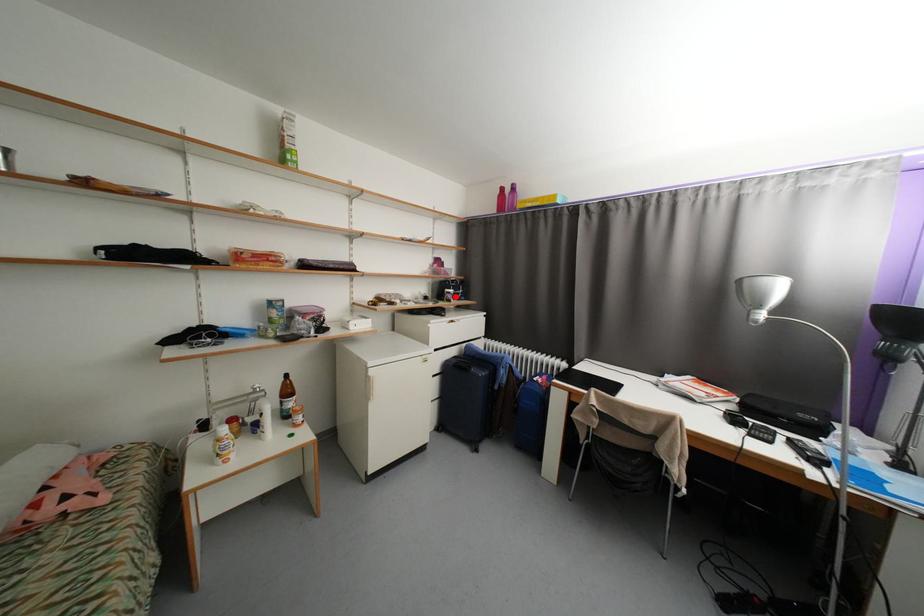
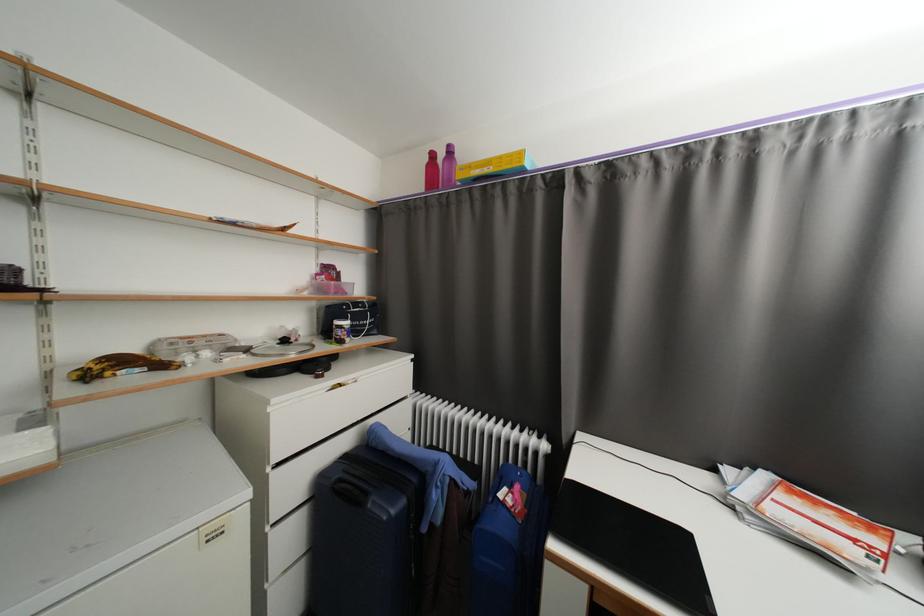
Where in the second image is the point corresponding to the highlighted location from the first image?

(346, 334)